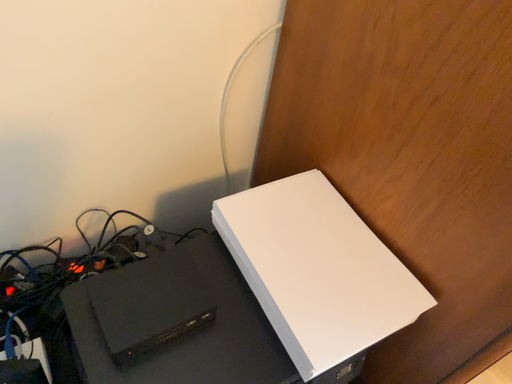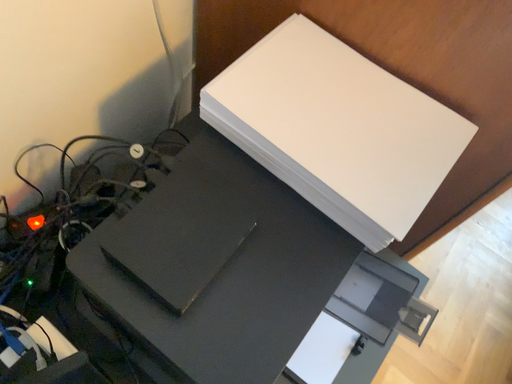
Question: Which way did the camera rotate in the video?

Choices:
 (A) rotated left
 (B) rotated right

Answer: (B)